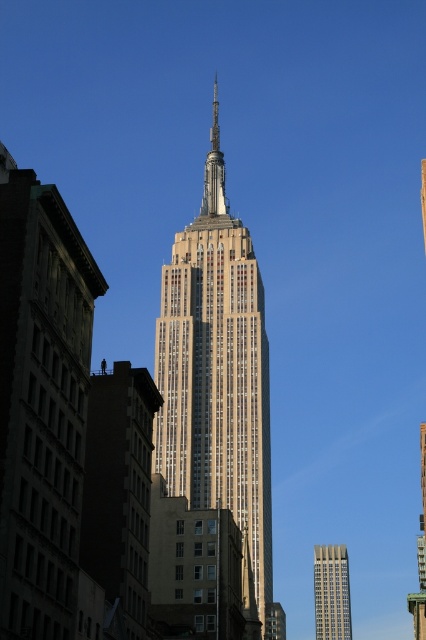
You are a photographer standing in the park across from the Empire State Building. You want to capture both the beige stone tower at center and the gray glass skyscraper at lower right in your shot. Based on their widths, which one should you focus on to ensure they both fit in the frame?

The beige stone tower at center might be wider than gray glass skyscraper at lower right, so focusing on the wider beige stone tower at center would ensure both fit in the frame.

You are an architect analyzing the skyline of New York City. You notice the beige stone tower at center and the gray glass skyscraper at lower right. Which of these two structures has a greater overall height?

The beige stone tower at center has a larger size compared to the gray glass skyscraper at lower right, so it is taller.